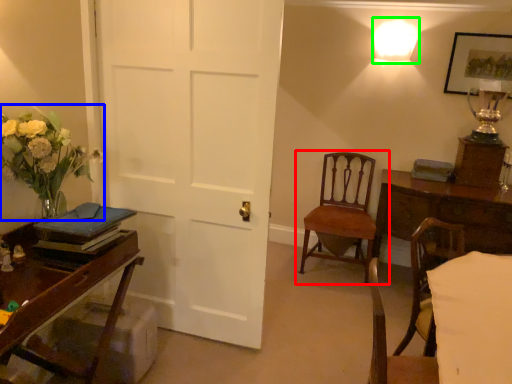
Question: Which object is the closest to the chair (highlighted by a red box)? Choose among these: floral arrangement (highlighted by a blue box) or lighting (highlighted by a green box).

Choices:
 (A) floral arrangement
 (B) lighting

Answer: (B)